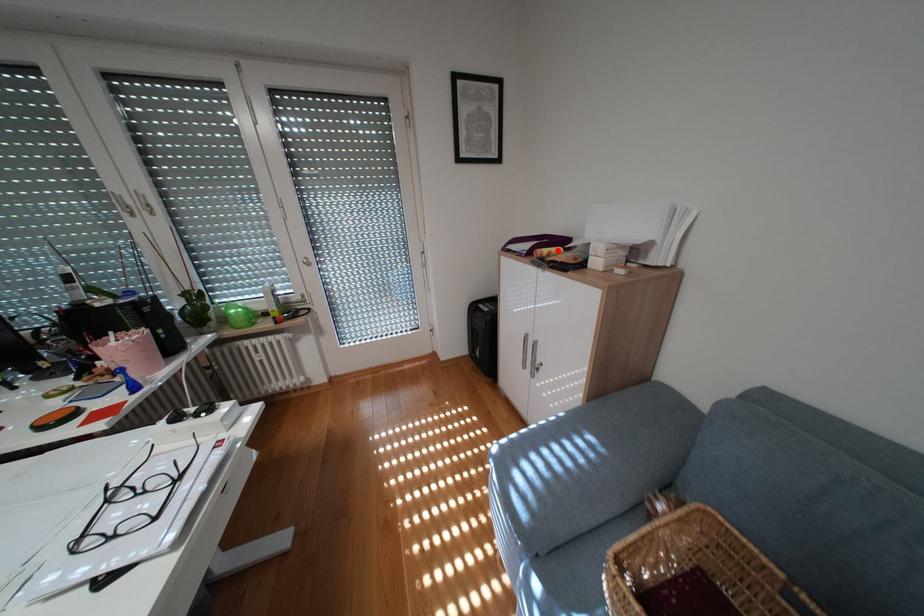
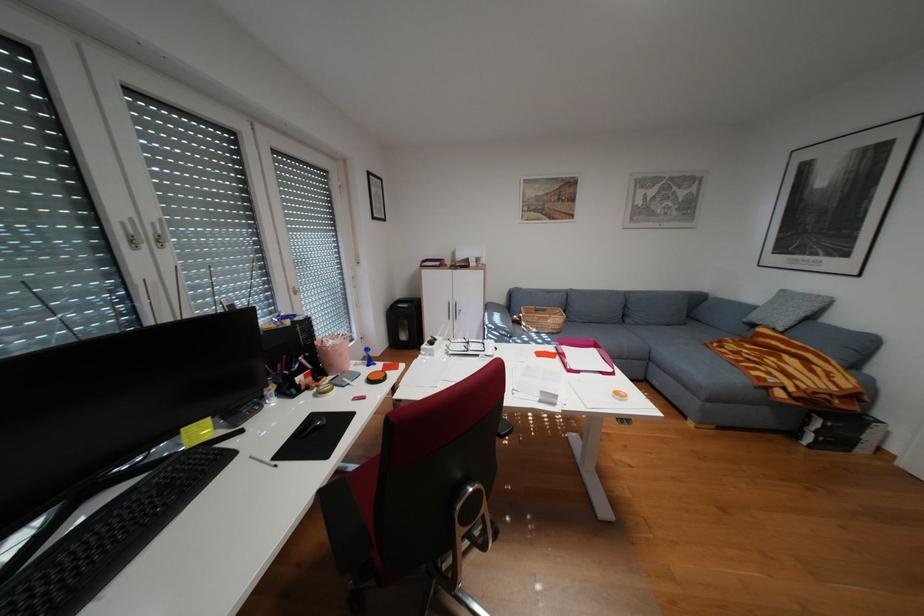
In the second image, find the point that corresponds to the highlighted location in the first image.

(460, 262)